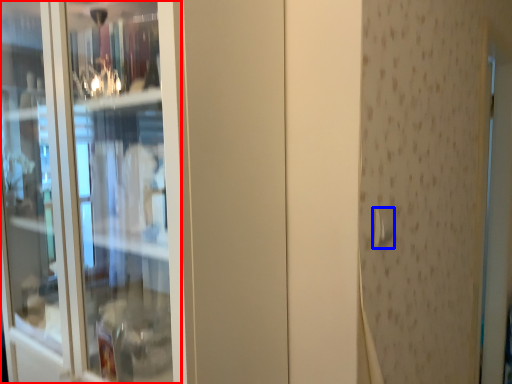
Question: Which of the following is the farthest to the observer, screen door (highlighted by a red box) or door handle (highlighted by a blue box)?

Choices:
 (A) screen door
 (B) door handle

Answer: (B)